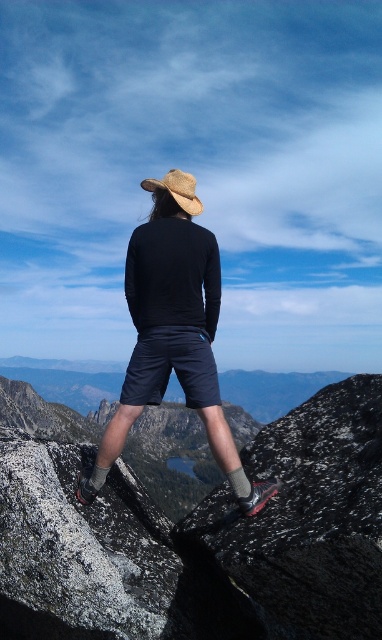
Question: Is granite boulder at center above dark blue cotton shorts at center?

Choices:
 (A) no
 (B) yes

Answer: (A)

Question: Which point is closer to the camera?

Choices:
 (A) (142, 577)
 (B) (194, 193)
 (C) (258, 436)

Answer: (A)

Question: Does black textured rock at center have a larger size compared to matte black shirt at center?

Choices:
 (A) no
 (B) yes

Answer: (B)

Question: Does matte black shirt at center appear on the left side of straw hat at center?

Choices:
 (A) yes
 (B) no

Answer: (B)

Question: Considering the real-world distances, which object is farthest from the dark blue cotton shorts at center?

Choices:
 (A) granite boulder at center
 (B) matte black shirt at center
 (C) straw hat at center
 (D) black textured rock at center

Answer: (C)

Question: Which point is closer to the camera?

Choices:
 (A) (163, 220)
 (B) (118, 596)

Answer: (B)